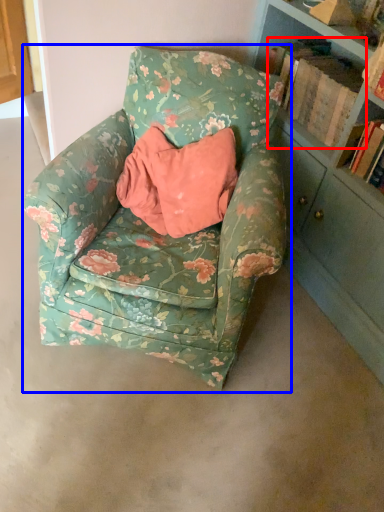
Question: Which point is closer to the camera, book (highlighted by a red box) or chair (highlighted by a blue box)?

Choices:
 (A) book
 (B) chair

Answer: (B)